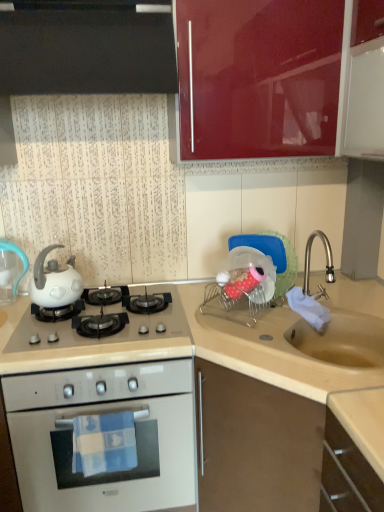
Question: Is black glossy cabinet at upper left, positioned as the first cabinetry in top-to-bottom order, facing away from white glossy kettle at left?

Choices:
 (A) no
 (B) yes

Answer: (A)

Question: Does black glossy cabinet at upper left, marked as the 3th cabinetry in a bottom-to-top arrangement, turn towards white glossy kettle at left?

Choices:
 (A) no
 (B) yes

Answer: (A)

Question: Does black glossy cabinet at upper left, marked as the 3th cabinetry in a bottom-to-top arrangement, appear on the left side of white glossy kettle at left?

Choices:
 (A) yes
 (B) no

Answer: (B)

Question: Considering the relative sizes of black glossy cabinet at upper left, marked as the 3th cabinetry in a bottom-to-top arrangement, and white glossy kettle at left in the image provided, is black glossy cabinet at upper left, marked as the 3th cabinetry in a bottom-to-top arrangement, wider than white glossy kettle at left?

Choices:
 (A) no
 (B) yes

Answer: (B)

Question: Is black glossy cabinet at upper left, positioned as the first cabinetry in top-to-bottom order, at the right side of white glossy kettle at left?

Choices:
 (A) yes
 (B) no

Answer: (A)

Question: From the image's perspective, would you say black glossy cabinet at upper left, positioned as the first cabinetry in top-to-bottom order, is shown under white glossy kettle at left?

Choices:
 (A) no
 (B) yes

Answer: (A)

Question: From the image's perspective, would you say white glossy gas stove at center is shown under white glossy oven at lower left?

Choices:
 (A) yes
 (B) no

Answer: (B)

Question: From the image's perspective, would you say white glossy gas stove at center is positioned over white glossy oven at lower left?

Choices:
 (A) no
 (B) yes

Answer: (B)

Question: Would you say white glossy oven at lower left is part of white glossy gas stove at center's contents?

Choices:
 (A) yes
 (B) no

Answer: (B)

Question: From a real-world perspective, is white glossy gas stove at center located higher than white glossy oven at lower left?

Choices:
 (A) no
 (B) yes

Answer: (B)

Question: Is white glossy gas stove at center facing away from white glossy oven at lower left?

Choices:
 (A) yes
 (B) no

Answer: (B)

Question: Is the depth of white glossy gas stove at center greater than that of white glossy oven at lower left?

Choices:
 (A) no
 (B) yes

Answer: (B)

Question: Is black glossy cabinet at upper left, positioned as the first cabinetry in top-to-bottom order, not within white glossy gas stove at center?

Choices:
 (A) no
 (B) yes

Answer: (B)